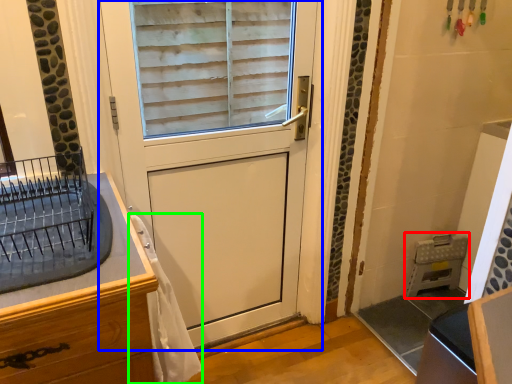
Question: Based on their relative distances, which object is farther from appliance (highlighted by a red box)? Choose from door (highlighted by a blue box) and material (highlighted by a green box).

Choices:
 (A) door
 (B) material

Answer: (B)